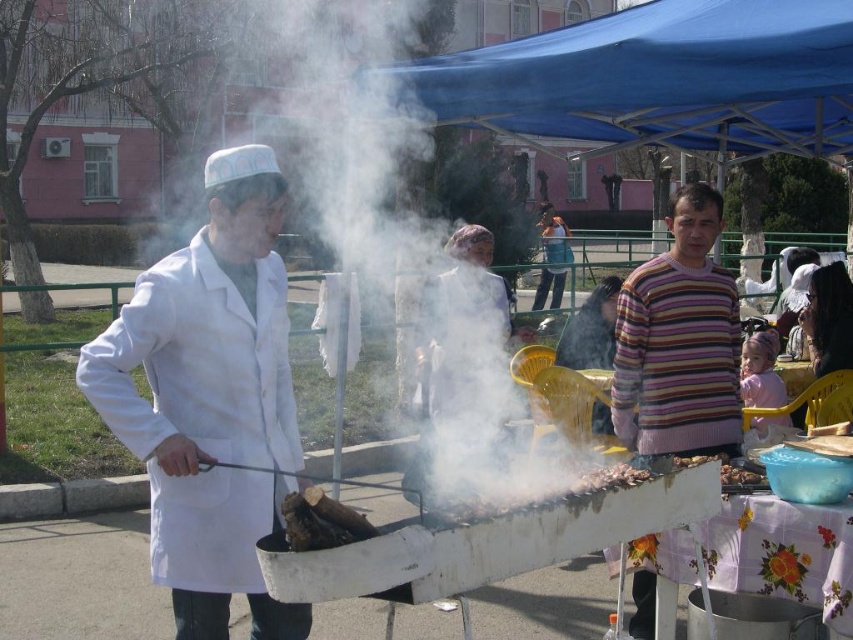
Which is in front, point (830, 264) or point (323, 525)?

Positioned in front is point (323, 525).

Between dark brown leather jacket at lower right and charcoal wood at grill center, which one is positioned higher?

dark brown leather jacket at lower right is above.

Describe the element at coordinates (828, 317) in the screenshot. I see `dark brown leather jacket at lower right` at that location.

Locate an element on the screen. The image size is (853, 640). dark brown leather jacket at lower right is located at coordinates (828, 317).

Which of these two, white matte lab coat at left or blue fabric canopy at upper center, stands taller?

With more height is white matte lab coat at left.

In the scene shown: Is white matte lab coat at left shorter than blue fabric canopy at upper center?

Incorrect, white matte lab coat at left's height does not fall short of blue fabric canopy at upper center's.

Does point (163, 387) come in front of point (491, 124)?

Yes, point (163, 387) is in front of point (491, 124).

You are a GUI agent. You are given a task and a screenshot of the screen. Output one action in this format:
    pyautogui.click(x=<x>, y=<y>)
    Task: Click on the white matte lab coat at left
    
    Given the screenshot: What is the action you would take?
    pyautogui.click(x=210, y=400)

Can you confirm if charcoal wood at grill center is shorter than charcoal wood at center?

No, charcoal wood at grill center is not shorter than charcoal wood at center.

Which of these two, charcoal wood at grill center or charcoal wood at center, stands shorter?

charcoal wood at center

Where is `charcoal wood at grill center`? This screenshot has height=640, width=853. charcoal wood at grill center is located at coordinates (321, 522).